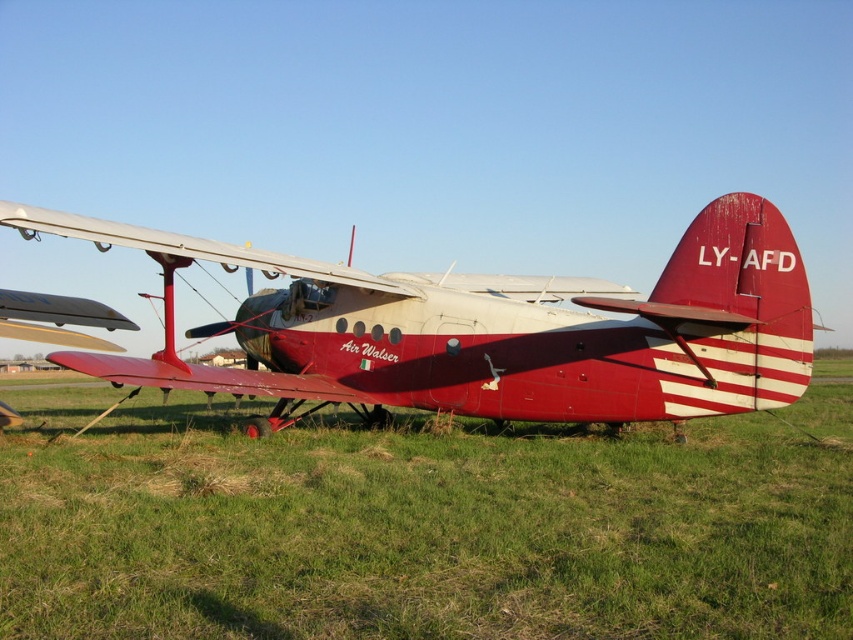
Question: Does green grass at lower center lie in front of matte red airplane at center?

Choices:
 (A) yes
 (B) no

Answer: (A)

Question: Is green grass at lower center to the right of matte red airplane at center from the viewer's perspective?

Choices:
 (A) no
 (B) yes

Answer: (B)

Question: Which point is closer to the camera?

Choices:
 (A) (289, 420)
 (B) (575, 561)

Answer: (B)

Question: Which point is closer to the camera?

Choices:
 (A) (306, 353)
 (B) (802, 550)

Answer: (B)

Question: Does green grass at lower center have a smaller size compared to matte red airplane at center?

Choices:
 (A) no
 (B) yes

Answer: (A)